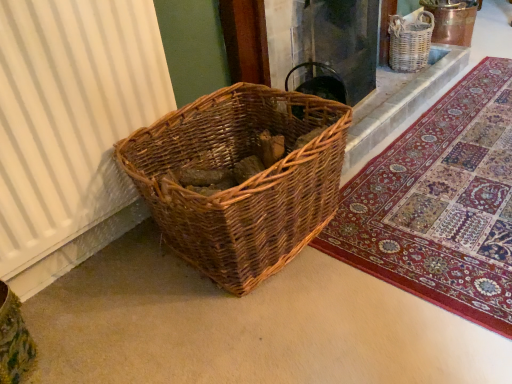
Question: Is woven wood basket at lower left at the back of woven wood basket at upper center?

Choices:
 (A) no
 (B) yes

Answer: (A)

Question: From the image's perspective, does woven wood basket at upper center appear higher than woven wood basket at lower left?

Choices:
 (A) no
 (B) yes

Answer: (B)

Question: Is the surface of woven wood basket at upper center in direct contact with woven wood basket at lower left?

Choices:
 (A) yes
 (B) no

Answer: (B)

Question: From the image's perspective, is woven wood basket at upper center beneath woven wood basket at lower left?

Choices:
 (A) no
 (B) yes

Answer: (A)

Question: From a real-world perspective, is woven wood basket at upper center under woven wood basket at lower left?

Choices:
 (A) no
 (B) yes

Answer: (A)

Question: Can you confirm if woven wood basket at upper center is wider than woven wood basket at lower left?

Choices:
 (A) yes
 (B) no

Answer: (B)

Question: From the image's perspective, is woven brown basket at upper right on top of woven wood basket at upper center?

Choices:
 (A) yes
 (B) no

Answer: (A)

Question: Is woven brown basket at upper right wider than woven wood basket at upper center?

Choices:
 (A) no
 (B) yes

Answer: (A)

Question: Would you consider woven brown basket at upper right to be distant from woven wood basket at upper center?

Choices:
 (A) no
 (B) yes

Answer: (A)

Question: Is woven wood basket at upper center at the back of woven brown basket at upper right?

Choices:
 (A) no
 (B) yes

Answer: (A)

Question: Is woven brown basket at upper right bigger than woven wood basket at upper center?

Choices:
 (A) yes
 (B) no

Answer: (B)

Question: Would you say woven brown basket at upper right contains woven wood basket at upper center?

Choices:
 (A) no
 (B) yes

Answer: (A)

Question: Is white ribbed curtain at left facing towards woven wood basket at lower left?

Choices:
 (A) yes
 (B) no

Answer: (A)